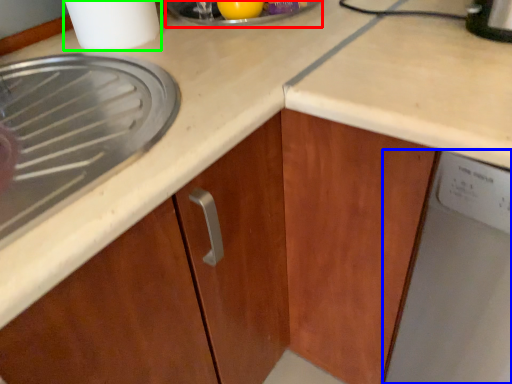
Question: Which is farther away from appliance (highlighted by a red box)? home appliance (highlighted by a blue box) or kitchen appliance (highlighted by a green box)?

Choices:
 (A) home appliance
 (B) kitchen appliance

Answer: (A)